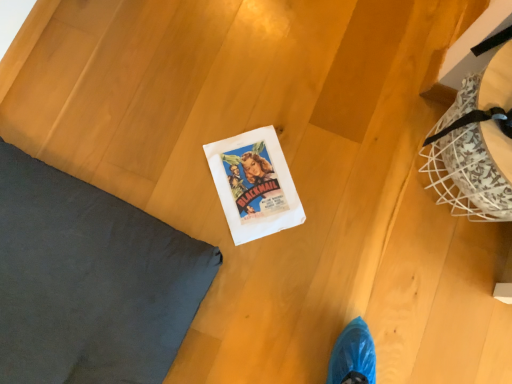
This screenshot has height=384, width=512. What are the coordinates of `vacant space in between dark gray fabric pillow at upper left and white paper comic book at center` in the screenshot? It's located at (160, 179).